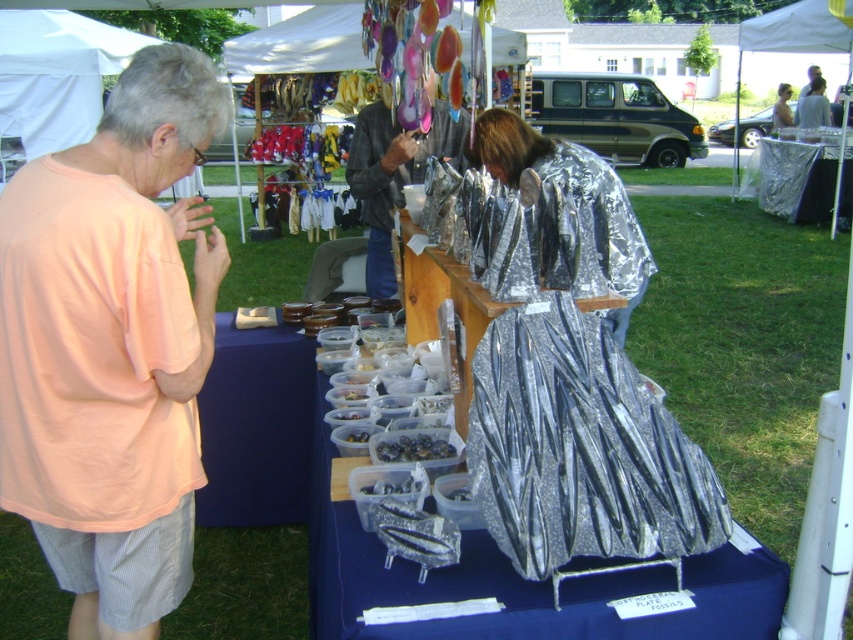
Question: Which point is farther from the camera taking this photo?

Choices:
 (A) (630, 452)
 (B) (473, 561)
 (C) (387, 483)
 (D) (349, 160)

Answer: (D)

Question: Can you confirm if pink cotton shirt at left is smaller than shiny metallic dress at center?

Choices:
 (A) no
 (B) yes

Answer: (B)

Question: Which object appears farthest from the camera in this image?

Choices:
 (A) pink cotton shirt at left
 (B) metallic silver plate at center
 (C) shiny metallic food at center

Answer: (C)

Question: Which point is closer to the camera taking this photo?

Choices:
 (A) (509, 417)
 (B) (788, 84)

Answer: (A)

Question: Is shiny metallic jacket at center to the right of metallic silver dress at center from the viewer's perspective?

Choices:
 (A) no
 (B) yes

Answer: (A)

Question: Does shiny metallic jacket at center appear under shiny metallic food at center?

Choices:
 (A) yes
 (B) no

Answer: (B)